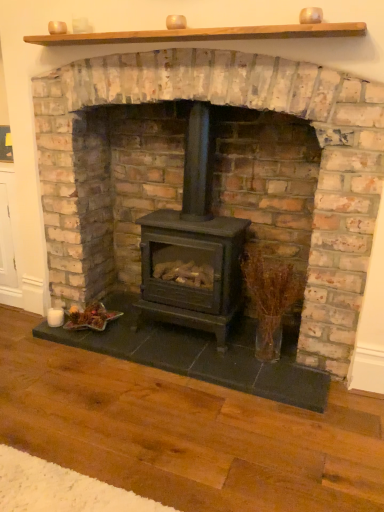
Describe the element at coordinates (193, 248) in the screenshot. I see `black matte wood burning stove at center` at that location.

Measure the distance between black matte wood burning stove at center and camera.

They are 6.33 feet apart.

This screenshot has width=384, height=512. What are the coordinates of `translucent glass vase at right` in the screenshot? It's located at pos(270,298).

Consider the image. Which object is positioned more to the right, translucent glass vase at right or black matte wood stove at center?

translucent glass vase at right is more to the right.

Between translucent glass vase at right and black matte wood stove at center, which one has larger size?

black matte wood stove at center.

Which object is more forward, translucent glass vase at right or black matte wood stove at center?

black matte wood stove at center.

Is translucent glass vase at right not inside black matte wood stove at center?

Actually, translucent glass vase at right is within black matte wood stove at center.

How distant is black matte wood burning stove at center from translucent glass vase at right?

They are 10.92 inches apart.

Can you confirm if black matte wood burning stove at center is taller than translucent glass vase at right?

Correct, black matte wood burning stove at center is much taller as translucent glass vase at right.

From the image's perspective, between black matte wood burning stove at center and translucent glass vase at right, who is located below?

translucent glass vase at right.

Which is more to the left, black matte wood burning stove at center or translucent glass vase at right?

From the viewer's perspective, black matte wood burning stove at center appears more on the left side.

Which point is more distant from viewer, (258, 350) or (192, 192)?

The point (258, 350) is farther.

Looking at this image, who is more distant, translucent glass vase at right or black matte wood burning stove at center?

translucent glass vase at right.

Is translucent glass vase at right far from black matte wood burning stove at center?

No.

In the scene shown: Considering the positions of objects translucent glass vase at right and black matte wood burning stove at center in the image provided, who is more to the right, translucent glass vase at right or black matte wood burning stove at center?

translucent glass vase at right is more to the right.

Does point (190, 151) lie behind point (251, 220)?

No, it is not.

From the image's perspective, is black matte wood burning stove at center over black matte wood stove at center?

Actually, black matte wood burning stove at center appears below black matte wood stove at center in the image.

Does black matte wood burning stove at center have a smaller size compared to black matte wood stove at center?

Yes, black matte wood burning stove at center is smaller than black matte wood stove at center.

Is point (301, 207) positioned before point (271, 323)?

No, it is not.

From the image's perspective, is black matte wood stove at center located above or below translucent glass vase at right?

Clearly, from the image's perspective, black matte wood stove at center is above translucent glass vase at right.

Which object is positioned more to the right, black matte wood stove at center or translucent glass vase at right?

translucent glass vase at right.

Looking at this image, is black matte wood stove at center oriented towards black matte wood burning stove at center?

Yes, black matte wood stove at center faces towards black matte wood burning stove at center.

Is black matte wood stove at center surrounding black matte wood burning stove at center?

Answer: Yes, black matte wood burning stove at center can be found within black matte wood stove at center.

Between point (52, 120) and point (160, 302), which one is positioned in front?

Positioned in front is point (52, 120).

Identify the location of fireplace in front of the translucent glass vase at right. Image resolution: width=384 pixels, height=512 pixels. (214, 172).

Find the location of a particular element. twig below the black matte wood burning stove at center (from the image's perspective) is located at coordinates (270, 298).

Based on their spatial positions, is black matte wood burning stove at center or translucent glass vase at right closer to black matte wood stove at center?

black matte wood burning stove at center.

Based on their spatial positions, is black matte wood stove at center or black matte wood burning stove at center further from translucent glass vase at right?

black matte wood stove at center is positioned further to the anchor translucent glass vase at right.

From the image, which object appears to be farther from black matte wood burning stove at center, translucent glass vase at right or black matte wood stove at center?

Based on the image, black matte wood stove at center appears to be further to black matte wood burning stove at center.

Considering their positions, is black matte wood burning stove at center positioned further to translucent glass vase at right than black matte wood stove at center?

Based on the image, black matte wood stove at center appears to be further to translucent glass vase at right.

Looking at the image, which one is located further to black matte wood stove at center, translucent glass vase at right or black matte wood burning stove at center?

The object further to black matte wood stove at center is translucent glass vase at right.

Consider the image. Considering their positions, is black matte wood stove at center positioned closer to black matte wood burning stove at center than translucent glass vase at right?

translucent glass vase at right.

The height and width of the screenshot is (512, 384). Find the location of `wood burning stove positioned between black matte wood stove at center and translucent glass vase at right from near to far`. wood burning stove positioned between black matte wood stove at center and translucent glass vase at right from near to far is located at coordinates (193, 248).